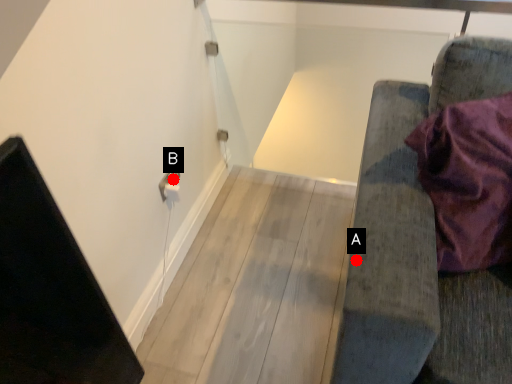
Question: Two points are circled on the image, labeled by A and B beside each circle. Which point appears farthest from the camera in this image?

Choices:
 (A) A is further
 (B) B is further

Answer: (B)